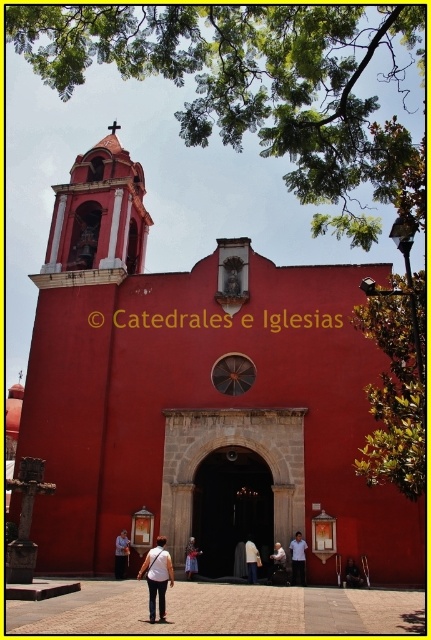
Between point (122, 544) and point (280, 566), which one is positioned in front?

Point (280, 566)

Can you confirm if denim jacket at center is smaller than white fabric shirt at center?

No.

Identify the location of denim jacket at center. This screenshot has width=431, height=640. (121, 554).

Can you confirm if white fabric bag at center is positioned to the left of denim jacket at center?

No, white fabric bag at center is not to the left of denim jacket at center.

You are a GUI agent. You are given a task and a screenshot of the screen. Output one action in this format:
    pyautogui.click(x=<x>, y=<y>)
    Task: Click on the white fabric bag at center
    Image resolution: width=431 pixels, height=640 pixels.
    Given the screenshot: What is the action you would take?
    pyautogui.click(x=156, y=577)

What are the coordinates of `white cotton shirt at center` in the screenshot? It's located at (297, 557).

Can you confirm if white cotton shirt at center is smaller than denim jacket at center?

No.

What do you see at coordinates (297, 557) in the screenshot? This screenshot has height=640, width=431. I see `white cotton shirt at center` at bounding box center [297, 557].

Identify the location of white cotton shirt at center. (297, 557).